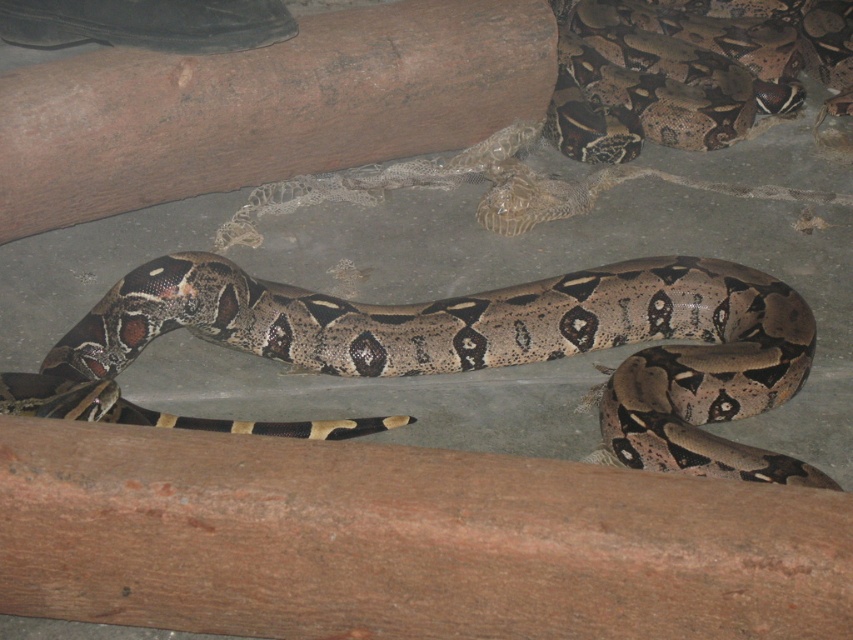
Between camouflage-patterned snake at center and brown textured snake at center, which one has more height?

Standing taller between the two is brown textured snake at center.

How far apart are camouflage-patterned snake at center and brown textured snake at center?

camouflage-patterned snake at center and brown textured snake at center are 1.66 meters apart from each other.

This screenshot has height=640, width=853. Identify the location of camouflage-patterned snake at center. (477, 348).

Which is more to the left, camouflage-patterned snake at center or brown rough log at center?

brown rough log at center

Can you confirm if camouflage-patterned snake at center is positioned to the right of brown rough log at center?

Correct, you'll find camouflage-patterned snake at center to the right of brown rough log at center.

Where is `camouflage-patterned snake at center`? This screenshot has height=640, width=853. camouflage-patterned snake at center is located at coordinates (477, 348).

Where is `camouflage-patterned snake at center`? camouflage-patterned snake at center is located at coordinates (477, 348).

The height and width of the screenshot is (640, 853). In order to click on brown rough log at center in this screenshot , I will do `click(265, 106)`.

Is brown rough log at center above brown textured snake at center?

No.

Is point (254, 93) positioned behind point (665, 74)?

No, it is in front of (665, 74).

The image size is (853, 640). I want to click on brown rough log at center, so click(x=265, y=106).